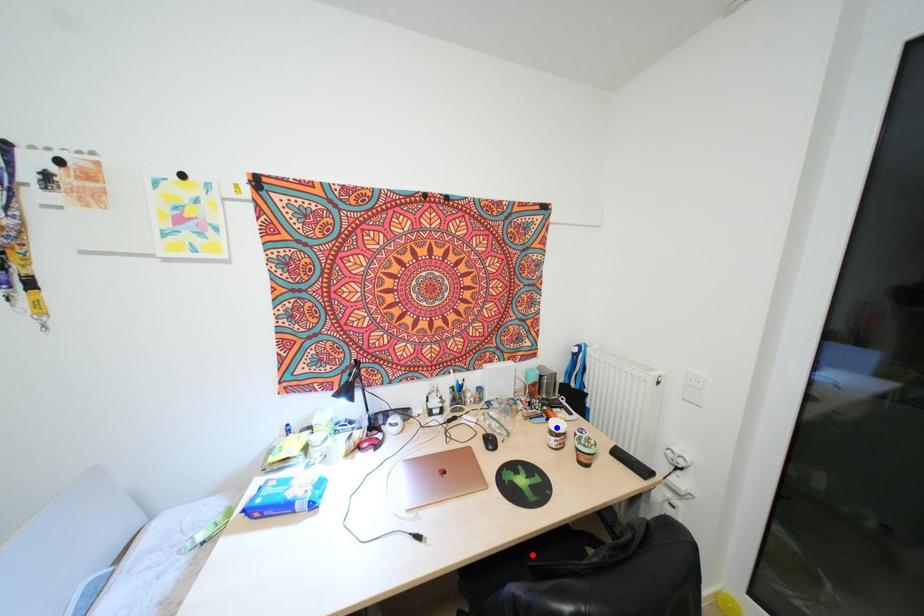
Question: Two points are marked on the image. Which point is closer to the camera?

Choices:
 (A) Blue point is closer.
 (B) Red point is closer.

Answer: (B)